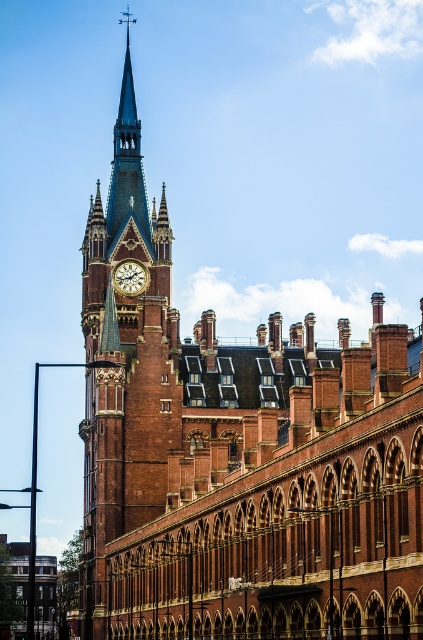
Question: Does polished copper spire at upper left lie behind gold metallic clock at upper center?

Choices:
 (A) no
 (B) yes

Answer: (B)

Question: Is polished copper spire at upper left wider than gold metallic clock at upper center?

Choices:
 (A) yes
 (B) no

Answer: (A)

Question: Is polished copper spire at upper left positioned behind gold metallic clock at upper center?

Choices:
 (A) yes
 (B) no

Answer: (A)

Question: Which object appears farthest from the camera in this image?

Choices:
 (A) polished copper spire at upper left
 (B) gold metallic clock at upper center

Answer: (A)